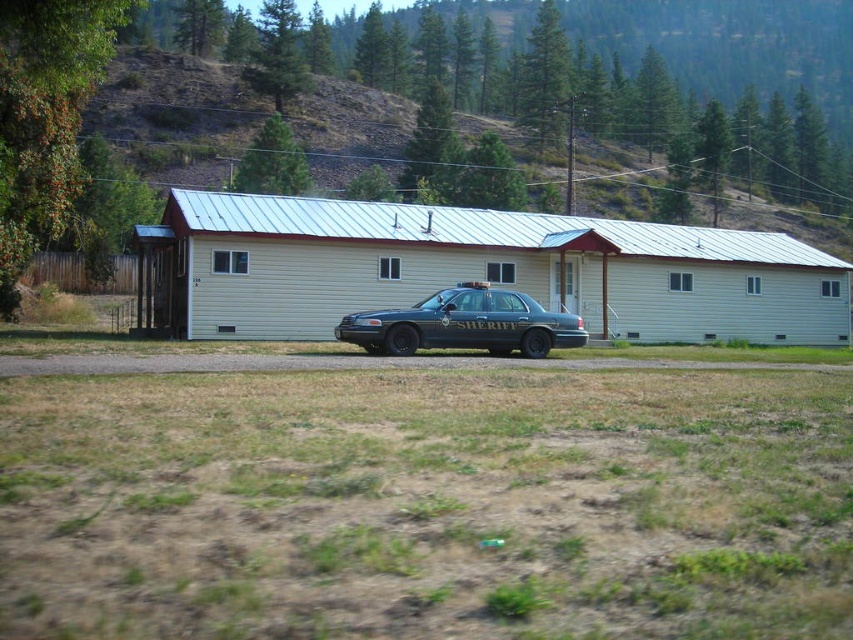
Question: Can you confirm if green grass at upper center is positioned below metallic blue sheriff car at center?

Choices:
 (A) no
 (B) yes

Answer: (A)

Question: Observing the image, what is the correct spatial positioning of green grass at upper center in reference to metallic blue sheriff car at center?

Choices:
 (A) above
 (B) below

Answer: (A)

Question: Can you confirm if green grass at upper center is wider than metallic blue sheriff car at center?

Choices:
 (A) yes
 (B) no

Answer: (A)

Question: Which of the following is the closest to the observer?

Choices:
 (A) green grass at upper center
 (B) metallic blue sheriff car at center

Answer: (B)

Question: Which point appears farthest from the camera in this image?

Choices:
 (A) (225, 108)
 (B) (485, 301)

Answer: (A)